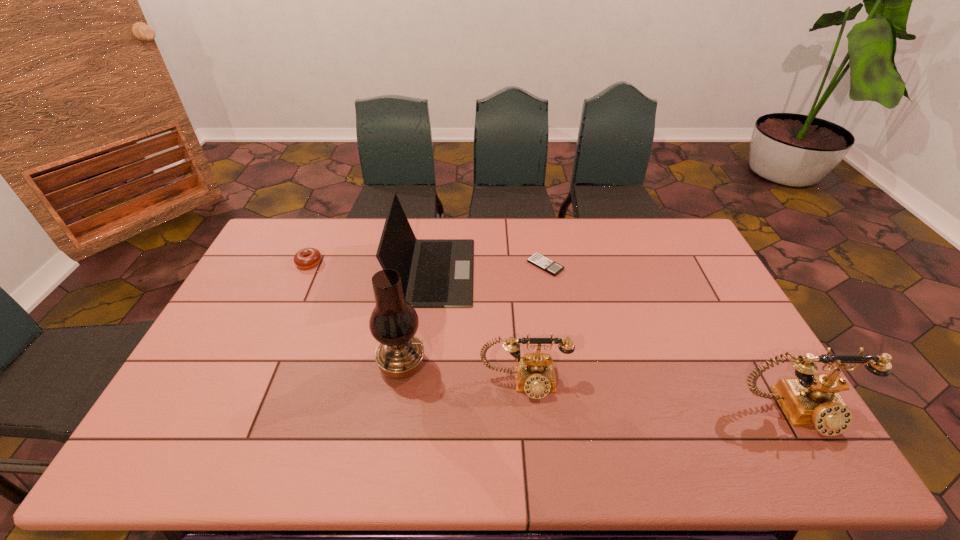
I want to click on object positioned at the near right corner, so click(812, 399).

Where is `blank area at the far edge`? This screenshot has height=540, width=960. blank area at the far edge is located at coordinates (533, 230).

In the image, there is a desktop. Where is `free space at the near edge`? The image size is (960, 540). free space at the near edge is located at coordinates (476, 411).

This screenshot has height=540, width=960. In the image, there is a desktop. What are the coordinates of `vacant space at the left edge` in the screenshot? It's located at (256, 273).

Identify the location of free spot at the far right corner of the desktop. The height and width of the screenshot is (540, 960). (684, 230).

At what (x,y) coordinates should I click in order to perform the action: click on vacant point located between the tallest object and the leftmost object. Please return your answer as a coordinate pair (x, y). This screenshot has width=960, height=540. Looking at the image, I should click on (355, 314).

What are the coordinates of `vacant region between the rightmost object and the laptop` in the screenshot? It's located at (614, 342).

What are the coordinates of `vacant point located between the laptop and the shortest object` in the screenshot? It's located at click(x=490, y=268).

Locate an element on the screen. The height and width of the screenshot is (540, 960). free space between the calculator and the third shortest object is located at coordinates (535, 324).

Image resolution: width=960 pixels, height=540 pixels. I want to click on free space between the rightmost object and the shorter telephone, so click(x=660, y=397).